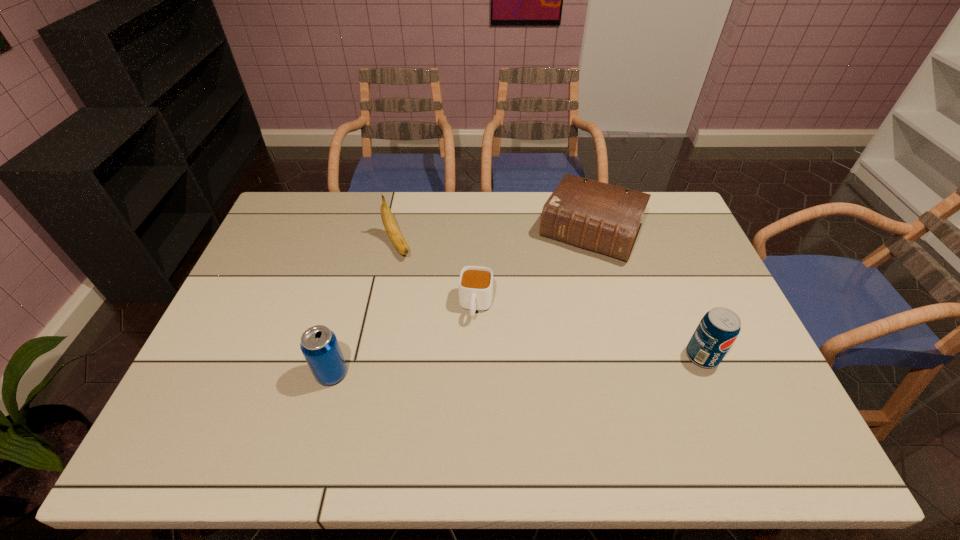
Locate an element on the screen. The width and height of the screenshot is (960, 540). pop situated at the right edge is located at coordinates (718, 329).

Find the location of `Bible present at the right edge`. Bible present at the right edge is located at coordinates (596, 216).

Find the location of `object positioned at the far right corner`. object positioned at the far right corner is located at coordinates (596, 216).

Where is `free space at the far edge of the desktop`? The image size is (960, 540). free space at the far edge of the desktop is located at coordinates (368, 212).

The width and height of the screenshot is (960, 540). I want to click on vacant space at the near edge of the desktop, so pyautogui.click(x=572, y=411).

Where is `vacant region at the left edge`? vacant region at the left edge is located at coordinates (296, 261).

Locate an element on the screen. This screenshot has height=540, width=960. free region at the far right corner of the desktop is located at coordinates (656, 226).

You are a GUI agent. You are given a task and a screenshot of the screen. Output one action in this format:
    pyautogui.click(x=<x>, y=<y>)
    Task: Click on the blank space at the near right corner
    This screenshot has width=960, height=540.
    Given the screenshot: What is the action you would take?
    pyautogui.click(x=727, y=406)

Locate an element on the screen. This screenshot has height=540, width=960. empty space between the Bible and the fourth object from right to left is located at coordinates (494, 239).

At what (x,y) coordinates should I click in order to perform the action: click on vacant area that lies between the leftmost object and the right pop. Please return your answer as a coordinate pair (x, y). The image size is (960, 540). Looking at the image, I should click on (516, 364).